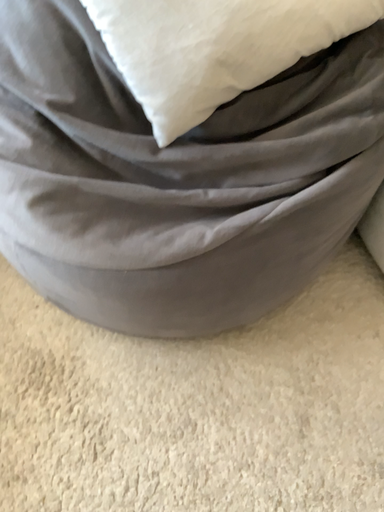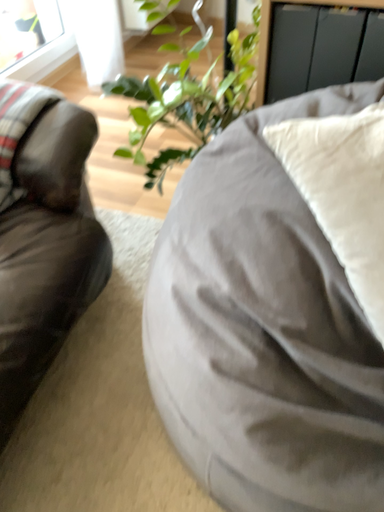
Question: Which way did the camera rotate in the video?

Choices:
 (A) rotated downward
 (B) rotated upward

Answer: (B)